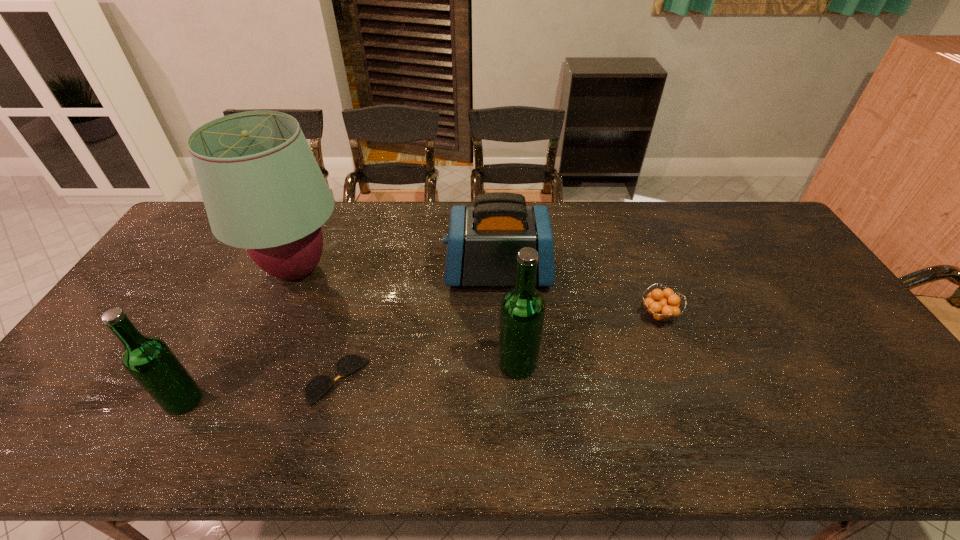
Identify the location of the nearer beer bottle. The image size is (960, 540). (149, 360).

In order to click on the left beer bottle in this screenshot , I will do `click(149, 360)`.

The image size is (960, 540). Identify the location of the farther beer bottle. (522, 313).

Image resolution: width=960 pixels, height=540 pixels. Identify the location of the fifth shortest object. (522, 313).

The width and height of the screenshot is (960, 540). I want to click on the tallest object, so click(263, 190).

Locate an element on the screen. the rightmost object is located at coordinates (661, 305).

The height and width of the screenshot is (540, 960). Identify the location of the second shortest object. (661, 305).

You are a GUI agent. You are given a task and a screenshot of the screen. Output one action in this format:
    pyautogui.click(x=<x>, y=<y>)
    Task: Click on the third shortest object
    This screenshot has width=960, height=540.
    Given the screenshot: What is the action you would take?
    pyautogui.click(x=483, y=242)

The width and height of the screenshot is (960, 540). What are the coordinates of `the shortest object` in the screenshot? It's located at (318, 386).

Image resolution: width=960 pixels, height=540 pixels. Find the location of `vacant space situated 0.340m on the right of the left beer bottle`. vacant space situated 0.340m on the right of the left beer bottle is located at coordinates (343, 401).